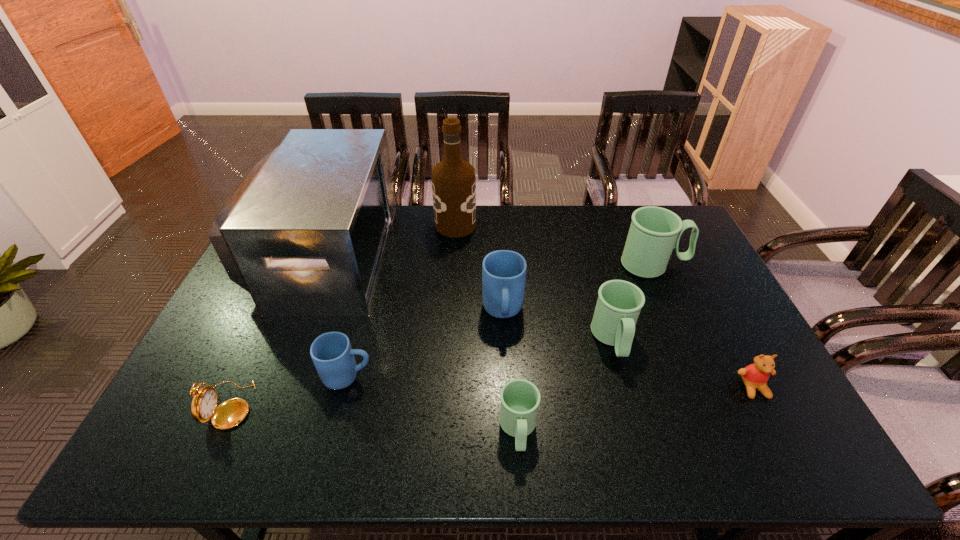
Locate an element on the screen. The width and height of the screenshot is (960, 540). free space between the pocket watch and the third object from right to left is located at coordinates (421, 372).

What are the coordinates of `vacant point located between the nearest green mug and the nearer blue mug` in the screenshot? It's located at 433,403.

I want to click on unoccupied position between the nearest mug and the brown alcohol, so click(x=487, y=327).

Where is `free space between the farthest mug and the teddy bear`? The height and width of the screenshot is (540, 960). free space between the farthest mug and the teddy bear is located at coordinates (704, 326).

Identify the location of free space between the sixth object from right to left and the leftmost green mug. [x=487, y=327].

Choose which object is the nearest neighbor to the pocket watch. Please provide its 2D coordinates. Your answer should be formatted as a tuple, i.e. [(x, y)], where the tuple contains the x and y coordinates of a point satisfying the conditions above.

[(332, 354)]

Locate an element on the screen. This screenshot has width=960, height=540. object that is the third closest to the bigger blue mug is located at coordinates (453, 180).

At what (x,y) coordinates should I click in order to perform the action: click on mug that is the second closest one to the bigger blue mug. Please return your answer as a coordinate pair (x, y). Looking at the image, I should click on (520, 398).

Identify which mug is the closest to the bigger blue mug. Please provide its 2D coordinates. Your answer should be formatted as a tuple, i.e. [(x, y)], where the tuple contains the x and y coordinates of a point satisfying the conditions above.

[(619, 303)]

This screenshot has width=960, height=540. Find the location of `green mug that stands as the second closest to the red teddy bear`. green mug that stands as the second closest to the red teddy bear is located at coordinates (654, 232).